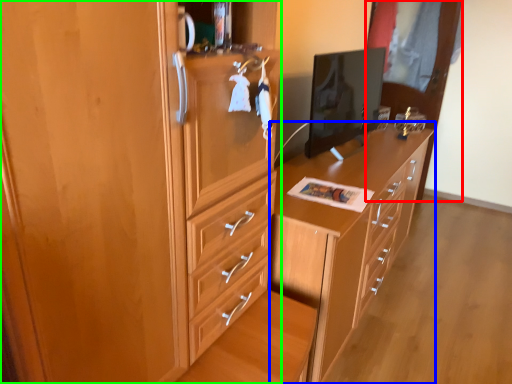
Question: Which object is positioned closest to glass door (highlighted by a red box)? Select from chest of drawers (highlighted by a blue box) and cabinetry (highlighted by a green box).

Choices:
 (A) chest of drawers
 (B) cabinetry

Answer: (A)